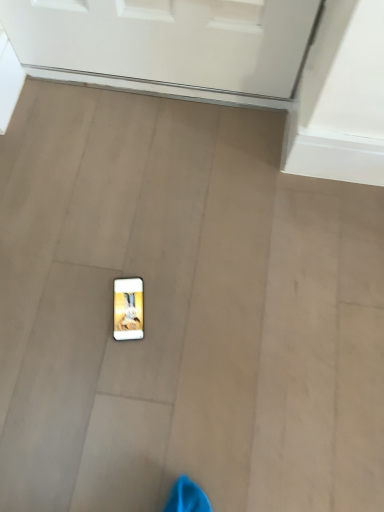
Where is `unoccupied region to the right of matte white phone at center`? This screenshot has height=512, width=384. unoccupied region to the right of matte white phone at center is located at coordinates [187, 310].